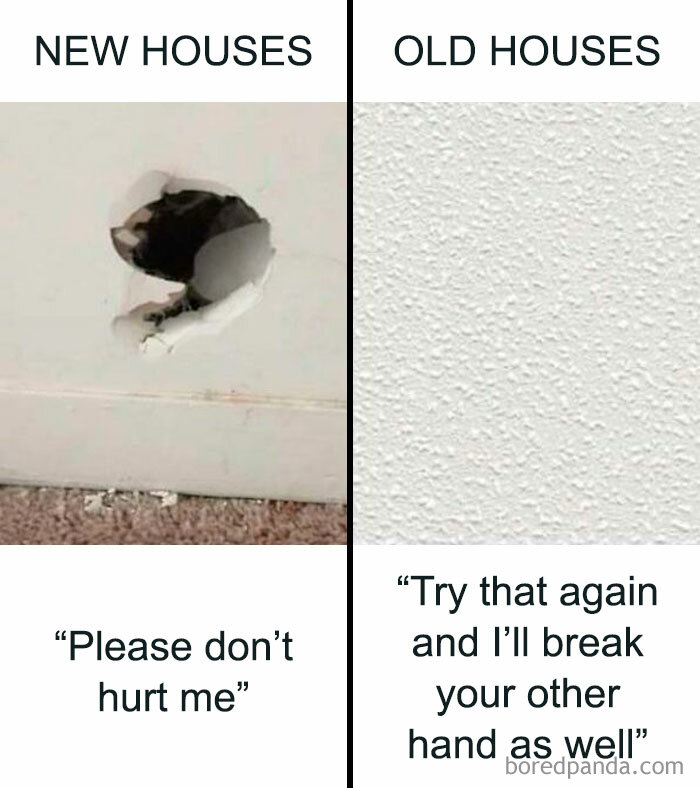
You are a GUI agent. You are given a task and a screenshot of the screen. Output one action in this format:
    pyautogui.click(x=<x>, y=<y>)
    Task: Click on the baseboard
    
    Given the screenshot: What is the action you would take?
    pyautogui.click(x=192, y=440)